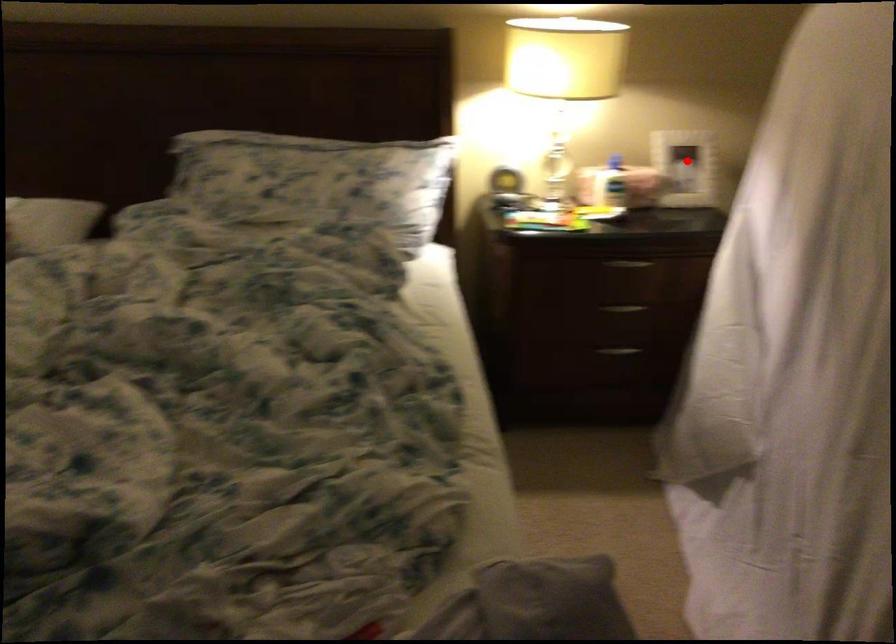
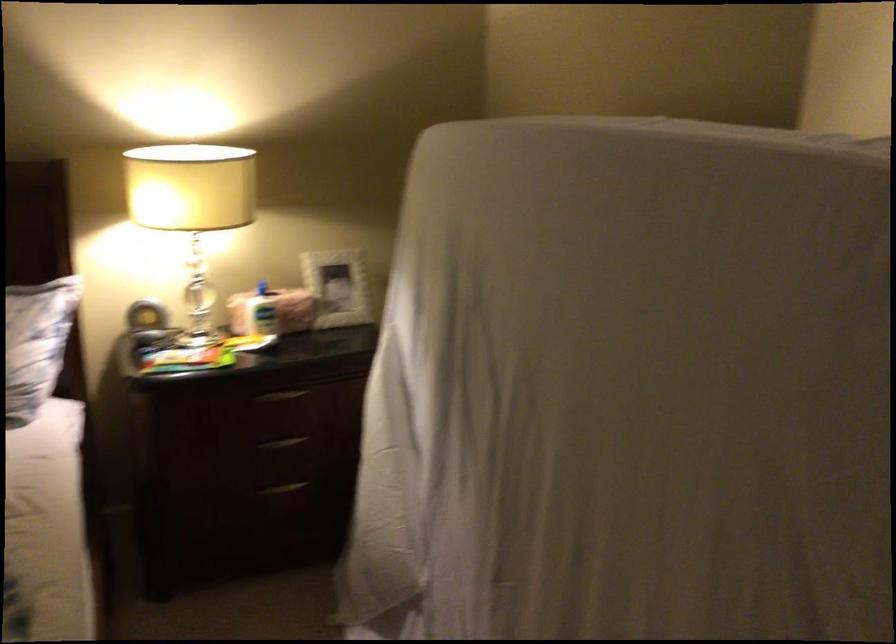
In the second image, find the point that corresponds to the highlighted location in the first image.

(337, 287)